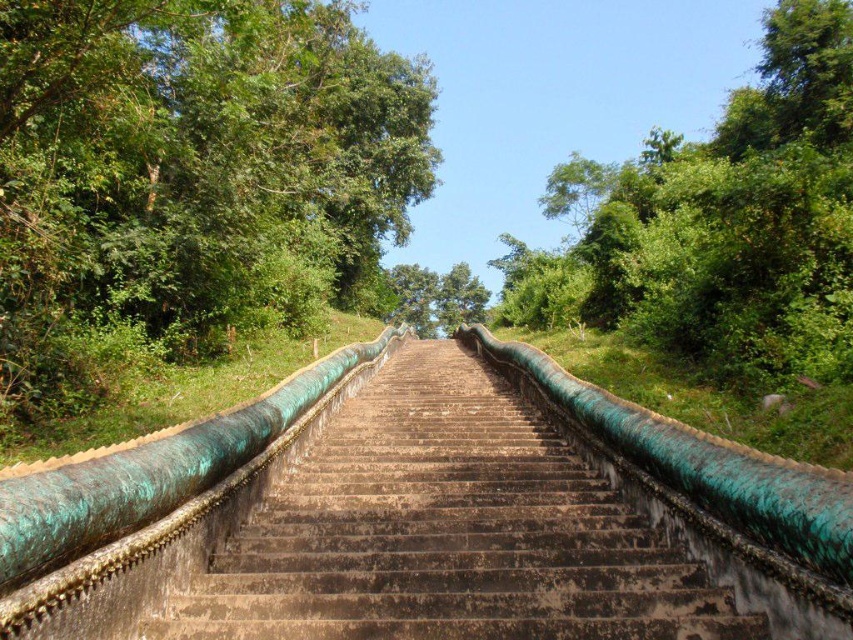
Question: Among these points, which one is farthest from the camera?

Choices:
 (A) (775, 70)
 (B) (62, 12)
 (C) (363, 484)

Answer: (A)

Question: Does green leafy tree at upper left have a smaller size compared to green leafy tree at upper right?

Choices:
 (A) no
 (B) yes

Answer: (B)

Question: Which point is farther from the camera taking this photo?

Choices:
 (A) (312, 6)
 (B) (351, 483)
 (C) (659, 276)

Answer: (A)

Question: Which of the following is the closest to the observer?

Choices:
 (A) (13, 296)
 (B) (612, 515)

Answer: (B)

Question: Can you confirm if green patina stairs at center is smaller than green leafy tree at upper right?

Choices:
 (A) yes
 (B) no

Answer: (A)

Question: Considering the relative positions of green patina stairs at center and green leafy tree at upper right in the image provided, where is green patina stairs at center located with respect to green leafy tree at upper right?

Choices:
 (A) below
 (B) above

Answer: (A)